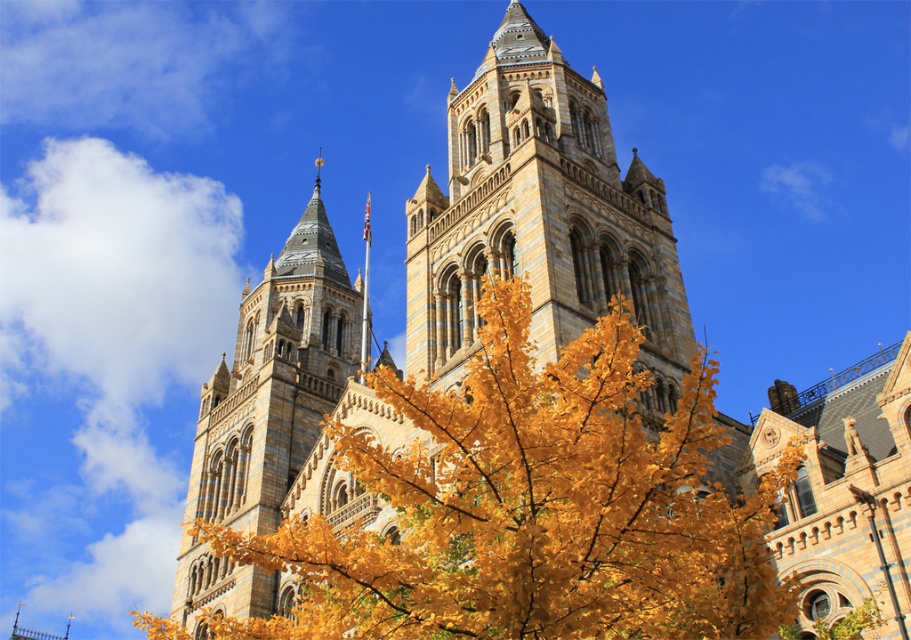
In the scene shown: You are standing in front of the grand building and want to take a photo of both towers. Which tower should you focus on first to ensure the brown stone tower at center is in the foreground?

You should focus on the brown stone tower at center first because it is closer to you than the stone tower at center, ensuring it appears in the foreground of your photo.